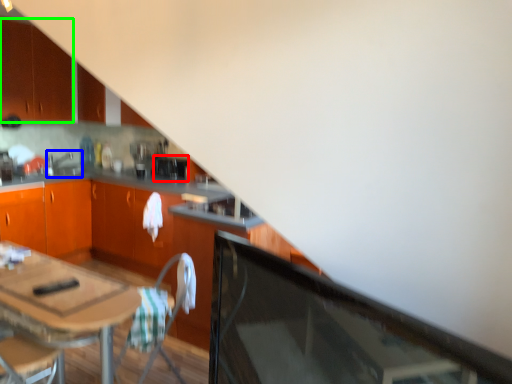
Question: Considering the real-world distances, which object is closest to appliance (highlighted by a red box)? sink (highlighted by a blue box) or cabinetry (highlighted by a green box).

Choices:
 (A) sink
 (B) cabinetry

Answer: (A)